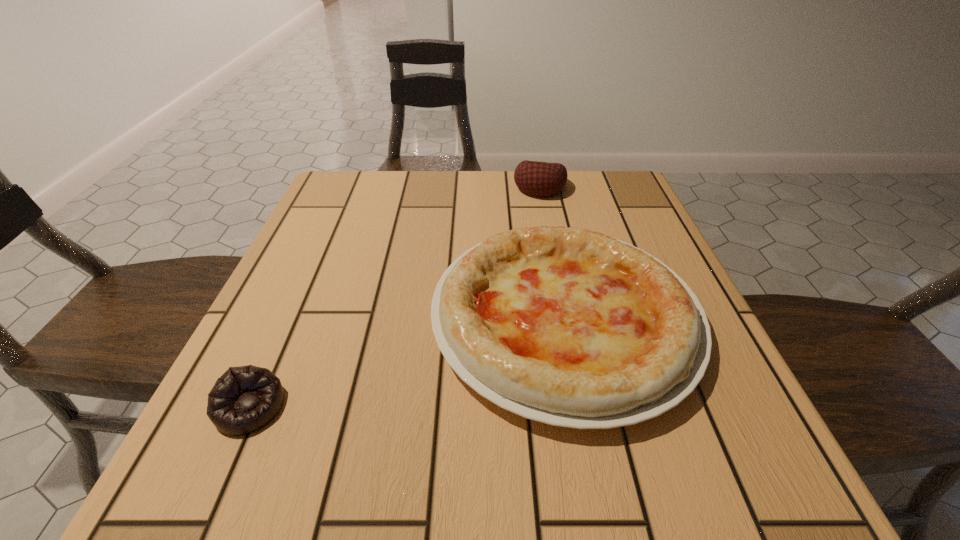
I want to click on the farthest object, so click(541, 179).

This screenshot has width=960, height=540. In order to click on the right beanbag in this screenshot , I will do (541, 179).

In order to click on pizza in this screenshot , I will do `click(569, 327)`.

Locate an element on the screen. The height and width of the screenshot is (540, 960). the shortest object is located at coordinates (244, 399).

Locate an element on the screen. The height and width of the screenshot is (540, 960). the left beanbag is located at coordinates coord(244,399).

At what (x,y) coordinates should I click in order to perform the action: click on free location located 0.200m on the left of the farthest object. Please return your answer as a coordinate pair (x, y). This screenshot has height=540, width=960. Looking at the image, I should click on (435, 187).

Locate an element on the screen. The image size is (960, 540). vacant space situated on the back of the shortest object is located at coordinates (299, 299).

The height and width of the screenshot is (540, 960). I want to click on object at the far edge, so click(541, 179).

This screenshot has width=960, height=540. I want to click on pizza present at the near edge, so click(x=569, y=327).

Find the location of a particular element. Image resolution: width=960 pixels, height=540 pixels. beanbag that is positioned at the near edge is located at coordinates (244, 399).